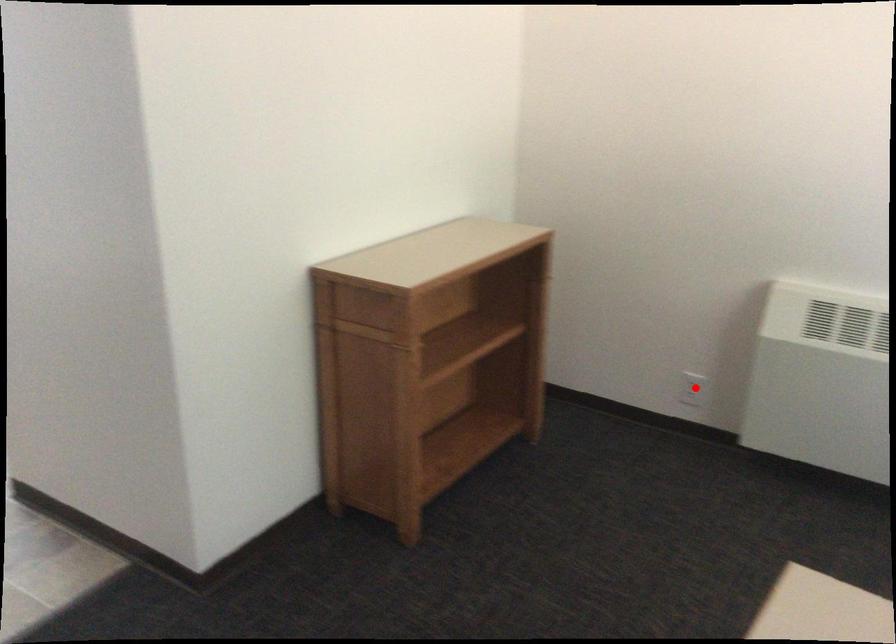
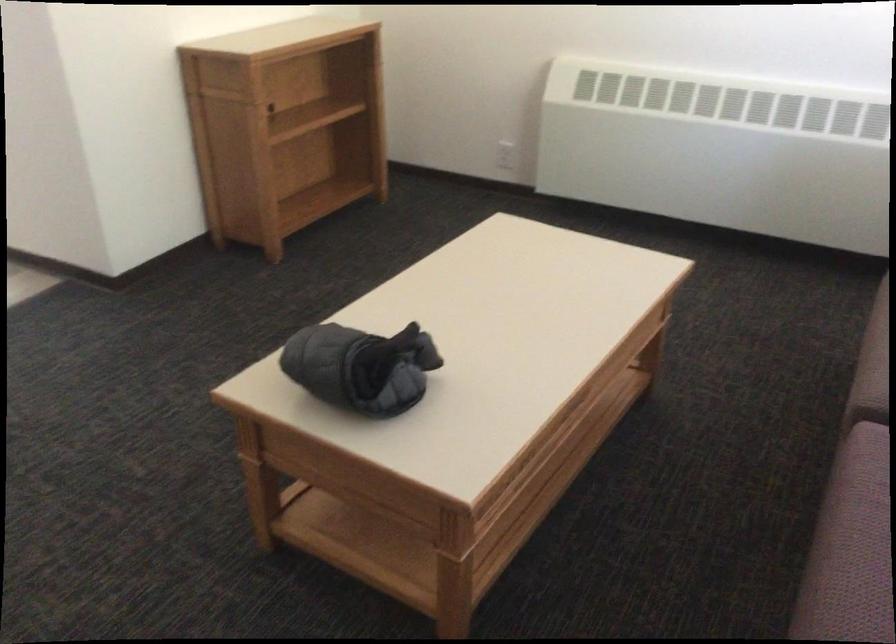
Where in the second image is the point corresponding to the highlighted location from the first image?

(505, 155)